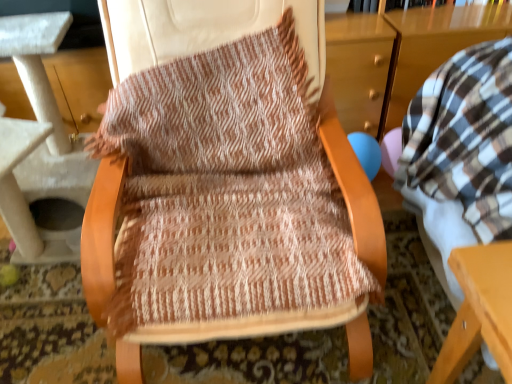
Image resolution: width=512 pixels, height=384 pixels. What do you see at coordinates (225, 184) in the screenshot?
I see `woven fabric chair at center` at bounding box center [225, 184].

What is the approximate width of woven fabric chair at center?

woven fabric chair at center is 27.18 inches wide.

Identify the location of woven fabric chair at center. (225, 184).

I want to click on white textured cat tree at left, so click(x=41, y=151).

This screenshot has height=384, width=512. Describe the element at coordinates (41, 151) in the screenshot. I see `white textured cat tree at left` at that location.

Identify the location of woven fabric chair at center. (225, 184).

Which is more to the right, white textured cat tree at left or woven fabric chair at center?

woven fabric chair at center is more to the right.

Is white textured cat tree at left in front of or behind woven fabric chair at center in the image?

Clearly, white textured cat tree at left is behind woven fabric chair at center.

Is point (41, 98) farther from camera compared to point (113, 218)?

Yes, point (41, 98) is behind point (113, 218).

From the image's perspective, which one is positioned lower, white textured cat tree at left or woven fabric chair at center?

woven fabric chair at center.

From a real-world perspective, relative to woven fabric chair at center, is white textured cat tree at left vertically above or below?

white textured cat tree at left is situated lower than woven fabric chair at center in the real world.

Which of these two, white textured cat tree at left or woven fabric chair at center, is wider?

white textured cat tree at left.

Does white textured cat tree at left have a lesser height compared to woven fabric chair at center?

In fact, white textured cat tree at left may be taller than woven fabric chair at center.

Does white textured cat tree at left have a smaller size compared to woven fabric chair at center?

No.

Is white textured cat tree at left outside of woven fabric chair at center?

That's correct, white textured cat tree at left is outside of woven fabric chair at center.

Are white textured cat tree at left and woven fabric chair at center located far from each other?

Actually, white textured cat tree at left and woven fabric chair at center are a little close together.

Does white textured cat tree at left turn towards woven fabric chair at center?

No, white textured cat tree at left is not aimed at woven fabric chair at center.

How different are the orientations of white textured cat tree at left and woven fabric chair at center in degrees?

The angular difference between white textured cat tree at left and woven fabric chair at center is 0.000457 degrees.

You are a GUI agent. You are given a task and a screenshot of the screen. Output one action in this format:
    pyautogui.click(x=<x>, y=<y>)
    Task: Click on the chair that is on the right side of white textured cat tree at left
    The height and width of the screenshot is (384, 512).
    Given the screenshot: What is the action you would take?
    pyautogui.click(x=225, y=184)

Based on the photo, considering the positions of objects woven fabric chair at center and white textured cat tree at left in the image provided, who is more to the left, woven fabric chair at center or white textured cat tree at left?

white textured cat tree at left.

Which object is closer to the camera taking this photo, woven fabric chair at center or white textured cat tree at left?

woven fabric chair at center is in front.

Is point (258, 216) positioned in front of point (74, 190)?

Yes, point (258, 216) is in front of point (74, 190).

From the image's perspective, which one is positioned lower, woven fabric chair at center or white textured cat tree at left?

woven fabric chair at center appears lower in the image.

From a real-world perspective, is woven fabric chair at center beneath white textured cat tree at left?

No, from a real-world perspective, woven fabric chair at center is not beneath white textured cat tree at left.

Considering the sizes of objects woven fabric chair at center and white textured cat tree at left in the image provided, who is wider, woven fabric chair at center or white textured cat tree at left?

white textured cat tree at left.

Considering the sizes of woven fabric chair at center and white textured cat tree at left in the image, is woven fabric chair at center taller or shorter than white textured cat tree at left?

woven fabric chair at center is shorter than white textured cat tree at left.

Who is bigger, woven fabric chair at center or white textured cat tree at left?

With larger size is white textured cat tree at left.

From the picture: Does woven fabric chair at center contain white textured cat tree at left?

No, white textured cat tree at left is not surrounded by woven fabric chair at center.

Would you consider woven fabric chair at center to be distant from white textured cat tree at left?

woven fabric chair at center is actually quite close to white textured cat tree at left.

Is woven fabric chair at center oriented towards white textured cat tree at left?

No.

Locate an element on the screen. table that is behind the woven fabric chair at center is located at coordinates (41, 151).

Locate an element on the screen. Image resolution: width=512 pixels, height=384 pixels. chair lying below the white textured cat tree at left (from the image's perspective) is located at coordinates (225, 184).

Identify the location of table that is on the left side of woven fabric chair at center. (41, 151).